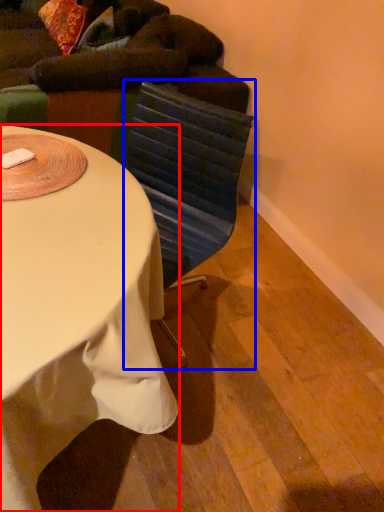
Question: Which point is further to the camera, desk (highlighted by a red box) or swivel chair (highlighted by a blue box)?

Choices:
 (A) desk
 (B) swivel chair

Answer: (B)